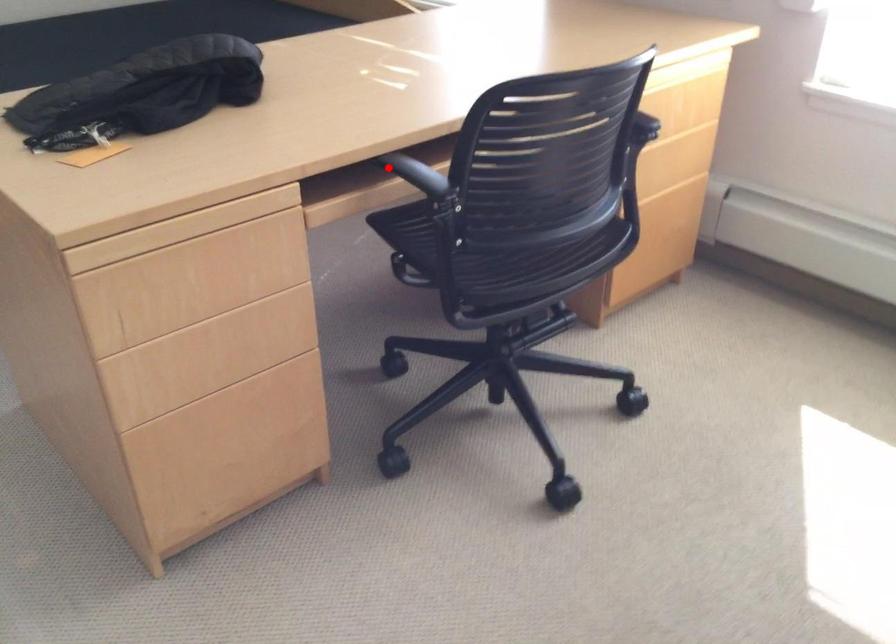
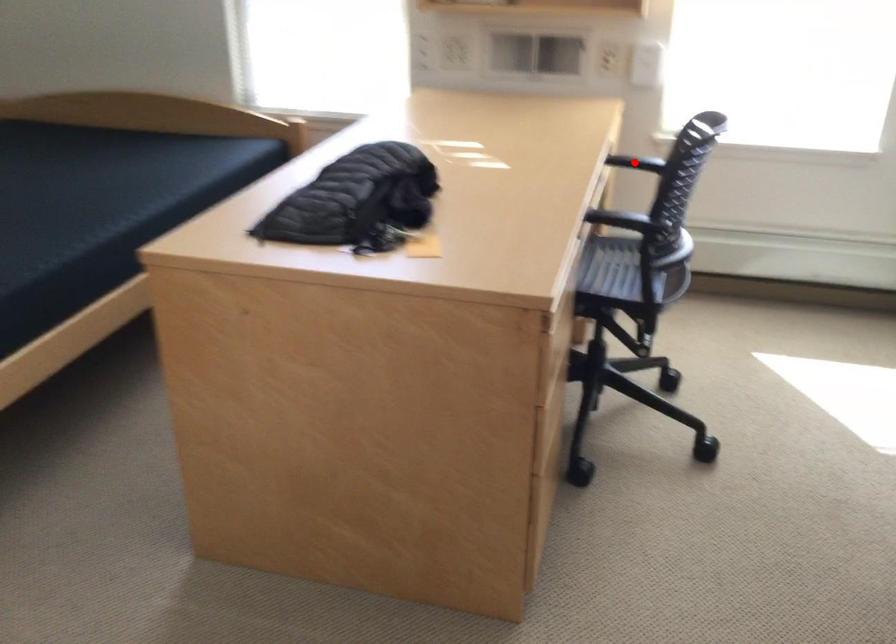
I am providing you with two images of the same scene from different viewpoints. A red point is marked on the first image and another point is marked on the second image. Do the highlighted points in image1 and image2 indicate the same real-world spot?

No